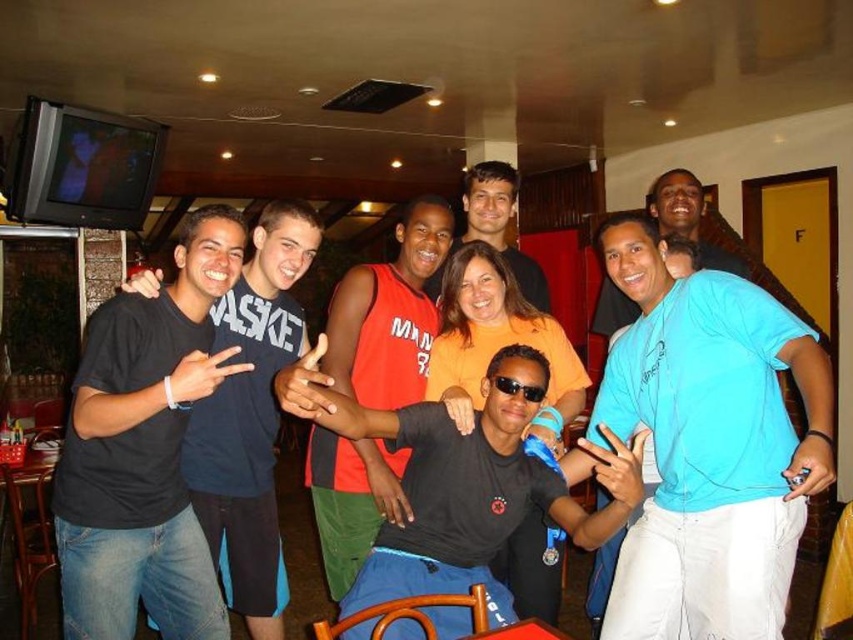
Question: Can you confirm if blue cotton t-shirt at center is bigger than black plastic sunglasses at center?

Choices:
 (A) yes
 (B) no

Answer: (A)

Question: Which point is farther from the camera taking this photo?

Choices:
 (A) (339, 401)
 (B) (498, 388)
 (C) (751, 620)

Answer: (B)

Question: Observing the image, what is the correct spatial positioning of black matte t-shirt at center in reference to black plastic sunglasses at center?

Choices:
 (A) above
 (B) below

Answer: (B)

Question: Which object appears closest to the camera in this image?

Choices:
 (A) black matte t-shirt at center
 (B) black plastic sunglasses at center
 (C) blue cotton t-shirt at center

Answer: (C)

Question: Which object is the farthest from the black plastic sunglasses at center?

Choices:
 (A) black matte t-shirt at center
 (B) blue cotton t-shirt at center

Answer: (B)

Question: Is blue cotton t-shirt at center closer to camera compared to black matte t-shirt at center?

Choices:
 (A) no
 (B) yes

Answer: (B)